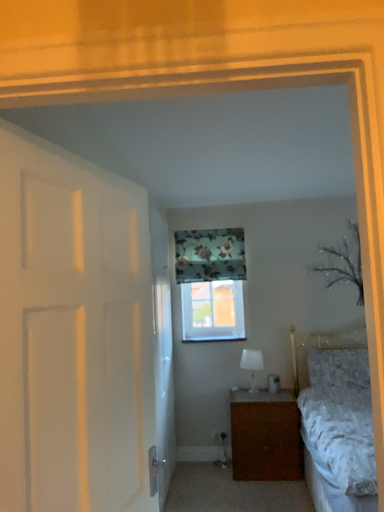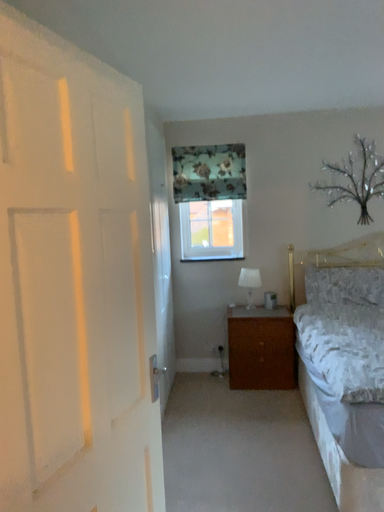
Question: How did the camera likely rotate when shooting the video?

Choices:
 (A) rotated downward
 (B) rotated upward

Answer: (A)